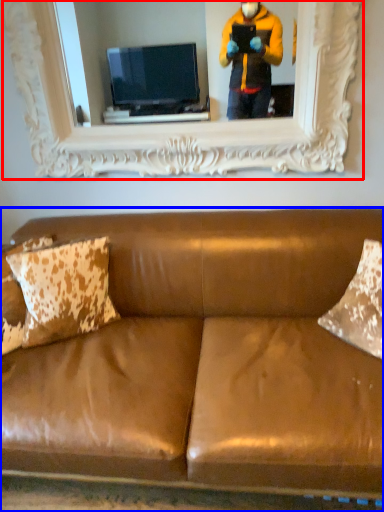
Question: Which object appears farthest to the camera in this image, picture frame (highlighted by a red box) or studio couch (highlighted by a blue box)?

Choices:
 (A) picture frame
 (B) studio couch

Answer: (A)